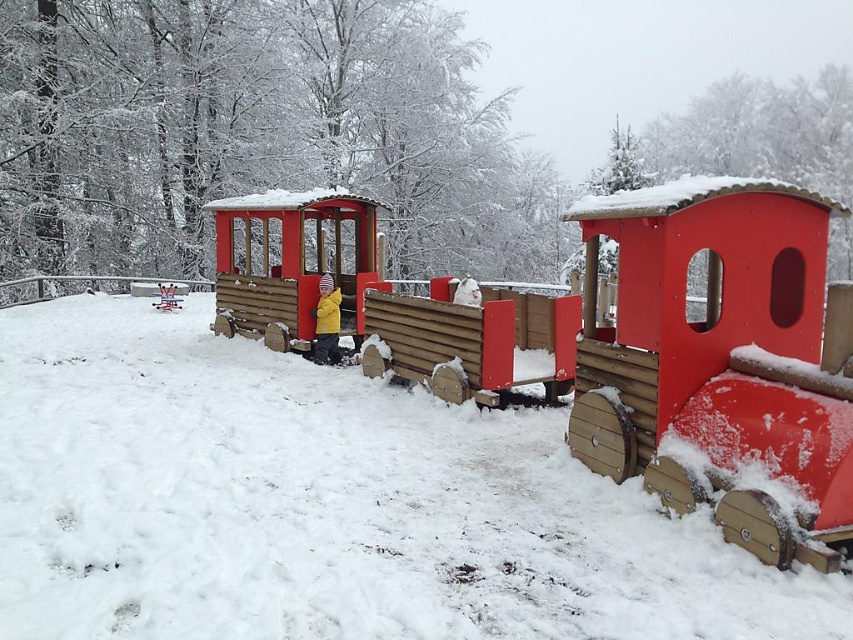
You are a parent trying to decide if your child can safely stand on the wooden train car at center while wearing the yellow fleece jacket at center. Based on the height difference between the two, can they do this?

The wooden train car at center is much taller than the yellow fleece jacket at center, so the child can safely stand on the wooden train car at center while wearing the yellow fleece jacket at center since the train car provides a stable and elevated platform.